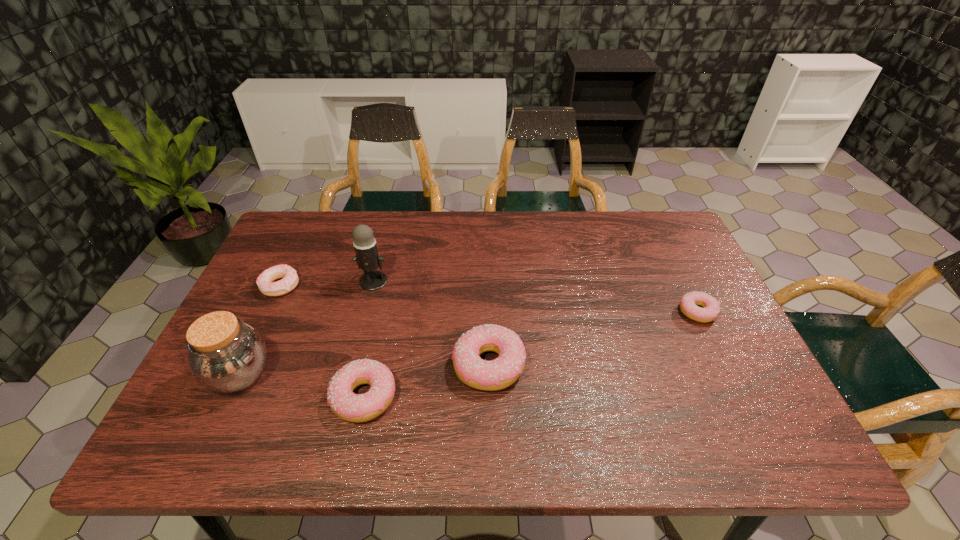
Locate an element on the screen. This screenshot has width=960, height=540. vacant area that lies between the jar and the leftmost doughnut is located at coordinates (260, 330).

Image resolution: width=960 pixels, height=540 pixels. I want to click on vacant point located between the microphone and the third shortest object, so click(370, 339).

You are a GUI agent. You are given a task and a screenshot of the screen. Output one action in this format:
    pyautogui.click(x=<x>, y=<y>)
    Task: Click on the empty space between the leftmost doughnut and the second tallest doughnut
    
    Given the screenshot: What is the action you would take?
    pyautogui.click(x=322, y=341)

The height and width of the screenshot is (540, 960). I want to click on unoccupied position between the rightmost doughnut and the third doughnut from left to right, so click(x=592, y=339).

Identify which object is located as the fifth nearest to the rightmost object. Please provide its 2D coordinates. Your answer should be formatted as a tuple, i.e. [(x, y)], where the tuple contains the x and y coordinates of a point satisfying the conditions above.

[(265, 283)]

Find the location of a particular element. This screenshot has height=540, width=960. object that is the third closest to the second tallest doughnut is located at coordinates (367, 258).

Select which doughnut is the closest to the third shortest object. Please provide its 2D coordinates. Your answer should be formatted as a tuple, i.e. [(x, y)], where the tuple contains the x and y coordinates of a point satisfying the conditions above.

[(497, 374)]

This screenshot has width=960, height=540. I want to click on doughnut that is the fourth closest to the fifth shortest object, so click(x=711, y=309).

Find the location of a particular element. free location that satisfies the following two spatial constraints: 1. on the front side of the leftmost doughnut; 2. on the right side of the second object from right to left is located at coordinates (242, 365).

Identify the location of vacant space that satisfies the following two spatial constraints: 1. on the front side of the jar; 2. on the right side of the third doughnut from right to left. (229, 397).